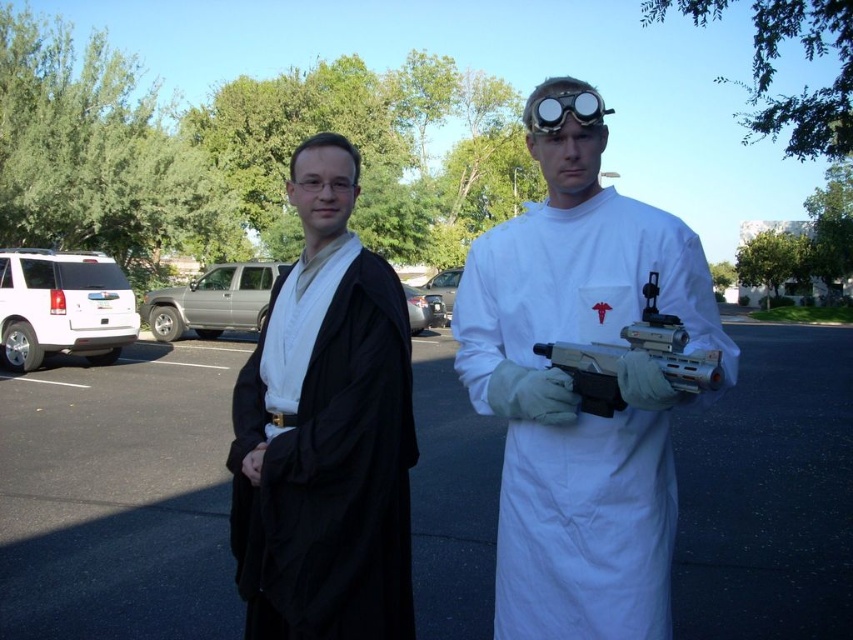
Question: From the image, what is the correct spatial relationship of asphalt at center in relation to matte black robe at center?

Choices:
 (A) above
 (B) below

Answer: (B)

Question: Is the position of white matte/soft fabric at center less distant than that of black matte robe at left?

Choices:
 (A) no
 (B) yes

Answer: (B)

Question: Which object is farther from the camera taking this photo?

Choices:
 (A) clear plastic goggles at center
 (B) asphalt at center
 (C) white matte/soft fabric at center

Answer: (A)

Question: Does black matte robe at left appear over clear plastic goggles at center?

Choices:
 (A) yes
 (B) no

Answer: (B)

Question: Which of these objects is positioned farthest from the white matte/soft fabric at center?

Choices:
 (A) metallic plastic gun at center
 (B) black matte robe at left
 (C) matte black robe at center

Answer: (B)

Question: Which of these objects is positioned farthest from the black matte robe at left?

Choices:
 (A) matte black robe at center
 (B) asphalt at center
 (C) clear plastic goggles at center

Answer: (B)